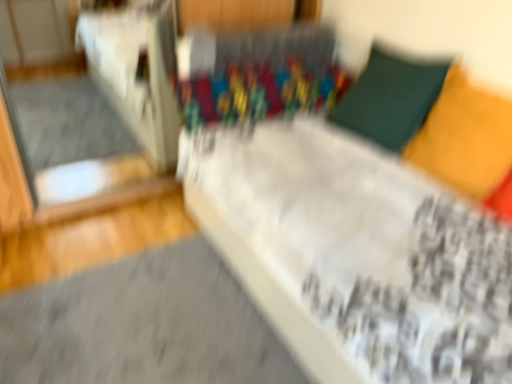
Question: From the image's perspective, is matte yellow pillow at upper right, arranged as the 1th pillow when viewed from the front, below transparent glass door at left?

Choices:
 (A) no
 (B) yes

Answer: (B)

Question: Is matte yellow pillow at upper right, which is the 2th pillow in back-to-front order, not close to transparent glass door at left?

Choices:
 (A) yes
 (B) no

Answer: (A)

Question: Can you confirm if matte yellow pillow at upper right, which is the 2th pillow in back-to-front order, is thinner than transparent glass door at left?

Choices:
 (A) yes
 (B) no

Answer: (A)

Question: Can you confirm if matte yellow pillow at upper right, arranged as the 1th pillow when viewed from the front, is wider than transparent glass door at left?

Choices:
 (A) no
 (B) yes

Answer: (A)

Question: From the image's perspective, would you say matte yellow pillow at upper right, which is the 2th pillow in back-to-front order, is positioned over transparent glass door at left?

Choices:
 (A) yes
 (B) no

Answer: (B)

Question: Is matte yellow pillow at upper right, which is the 2th pillow in back-to-front order, directly adjacent to transparent glass door at left?

Choices:
 (A) no
 (B) yes

Answer: (A)

Question: Is transparent glass door at left surrounding velvet green pillow at upper right, marked as the 1th pillow in a back-to-front arrangement?

Choices:
 (A) yes
 (B) no

Answer: (B)

Question: Is the depth of transparent glass door at left greater than that of velvet green pillow at upper right, marked as the 1th pillow in a back-to-front arrangement?

Choices:
 (A) yes
 (B) no

Answer: (A)

Question: Is transparent glass door at left smaller than velvet green pillow at upper right, marked as the 1th pillow in a back-to-front arrangement?

Choices:
 (A) no
 (B) yes

Answer: (A)

Question: From a real-world perspective, is transparent glass door at left located higher than velvet green pillow at upper right, marked as the 1th pillow in a back-to-front arrangement?

Choices:
 (A) yes
 (B) no

Answer: (B)

Question: Is transparent glass door at left positioned far away from velvet green pillow at upper right, the second pillow from the front?

Choices:
 (A) no
 (B) yes

Answer: (B)

Question: Is transparent glass door at left wider than velvet green pillow at upper right, marked as the 1th pillow in a back-to-front arrangement?

Choices:
 (A) no
 (B) yes

Answer: (B)

Question: Would you say transparent glass door at left is a long distance from matte yellow pillow at upper right, arranged as the 1th pillow when viewed from the front?

Choices:
 (A) yes
 (B) no

Answer: (A)